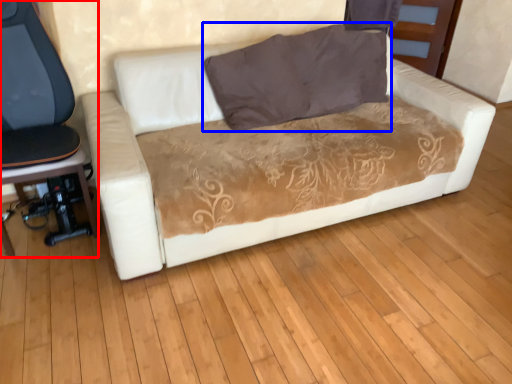
Question: Which object is closer to the camera taking this photo, chair (highlighted by a red box) or pillow (highlighted by a blue box)?

Choices:
 (A) chair
 (B) pillow

Answer: (A)